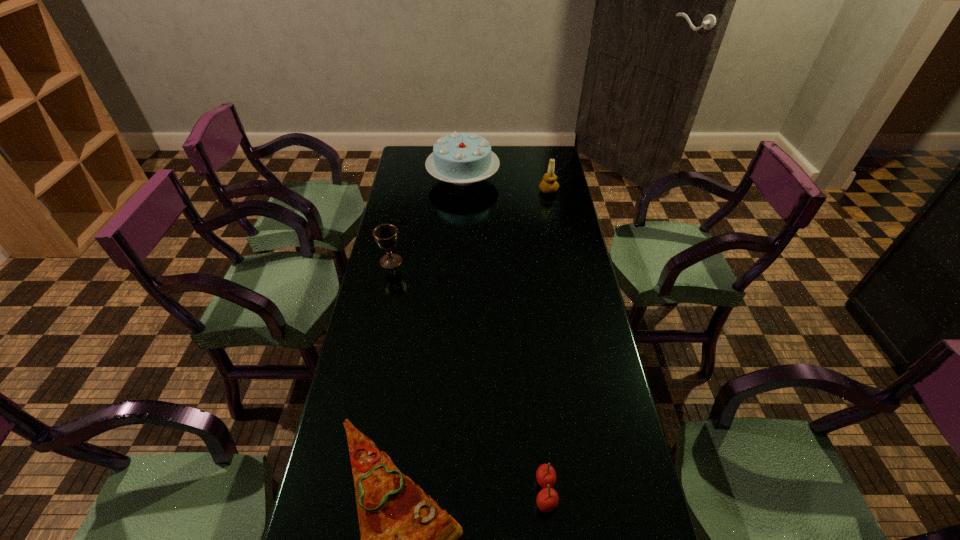
Where is `birthday cake`? The width and height of the screenshot is (960, 540). birthday cake is located at coordinates pos(461,158).

Where is `the rightmost object`? The width and height of the screenshot is (960, 540). the rightmost object is located at coordinates (549, 185).

The height and width of the screenshot is (540, 960). What are the coordinates of `chalice` in the screenshot? It's located at (386, 235).

This screenshot has width=960, height=540. I want to click on cherry, so click(x=547, y=499).

Where is `the second shortest object`? the second shortest object is located at coordinates (547, 499).

Image resolution: width=960 pixels, height=540 pixels. Identify the location of free space located 0.100m on the front of the tallest object. (462, 214).

Find the location of `blank area located on the left of the candle_holder`. blank area located on the left of the candle_holder is located at coordinates (471, 191).

The image size is (960, 540). Identify the location of vacant space situated on the front of the third farthest object. click(x=386, y=286).

You are a GUI agent. You are given a task and a screenshot of the screen. Output one action in this format:
    pyautogui.click(x=<x>, y=<y>)
    Task: Click on the free region located on the right of the fourth object from left to right
    The height and width of the screenshot is (540, 960).
    Given the screenshot: What is the action you would take?
    pyautogui.click(x=624, y=491)

Identify the location of object at the far edge. Image resolution: width=960 pixels, height=540 pixels. (461, 158).